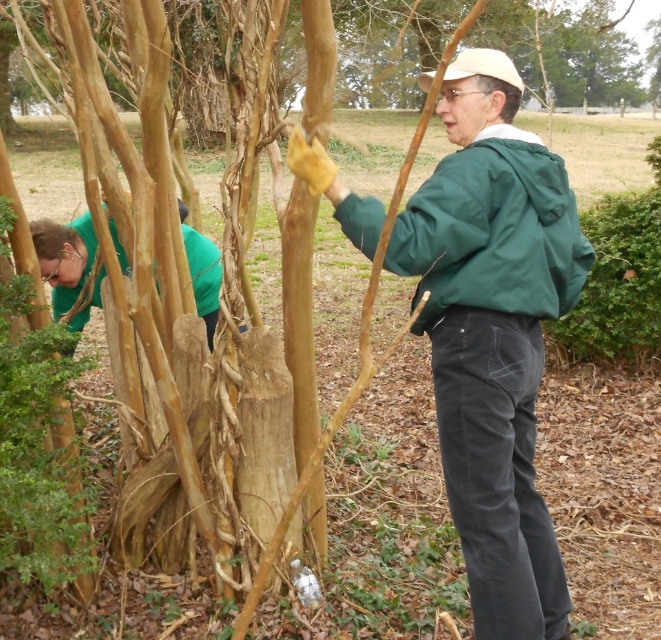
You are a photographer trying to capture both the green matte jacket at center and the green matte shirt at left in a single photo. Since you want to ensure both are fully visible, which object should you position closer to the camera to avoid cropping?

The green matte jacket at center is taller than the green matte shirt at left, so positioning the green matte jacket at center closer to the camera will help ensure both are fully visible without cropping.

You are standing in the middle of the scene and want to move towards the green matte jacket at right and the green matte shirt at left. Which direction should you turn to reach each one?

To reach the green matte jacket at right, turn to your right. To reach the green matte shirt at left, turn to your left.